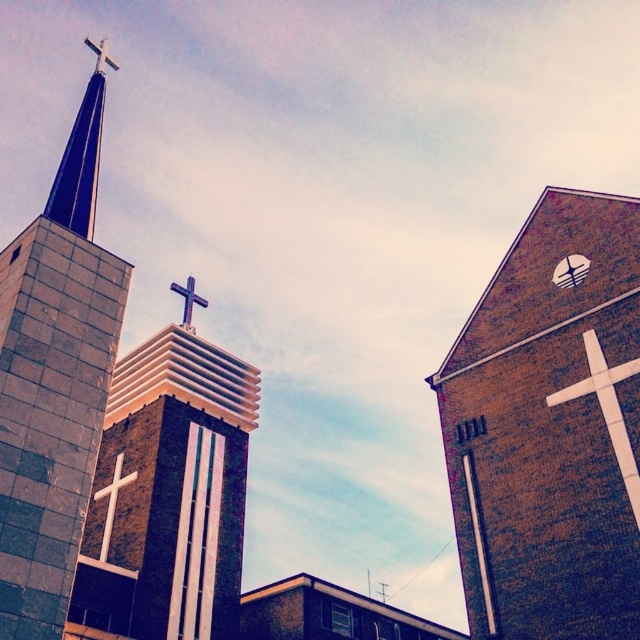
You are standing at the base of the church and want to take a photo of the smooth concrete steeple at left. Which direction should you face to ensure it is centered in your camera view?

The smooth concrete steeple at left is located at point (54, 381), so you should face towards the left side of the church to center it in your camera view.

You are an architect analyzing the church design. You notice the white brick cross at upper center and the metallic clock face at upper right. Which object has a greater width?

The white brick cross at upper center has a greater width than the metallic clock face at upper right.